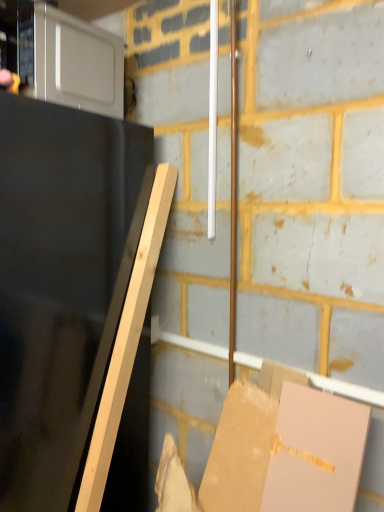
Where is `matte black tv at left`? The height and width of the screenshot is (512, 384). matte black tv at left is located at coordinates (61, 284).

Image resolution: width=384 pixels, height=512 pixels. What do you see at coordinates (61, 284) in the screenshot?
I see `matte black tv at left` at bounding box center [61, 284].

Consider the image. What is the approximate height of matte black tv at left?

matte black tv at left is 5.34 feet in height.

Find the location of a particular element. matte black tv at left is located at coordinates (61, 284).